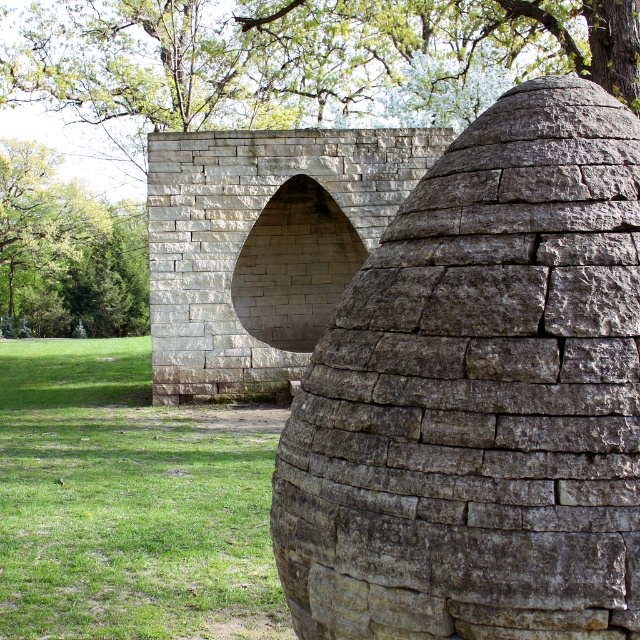
How distant is green grass at lower left from green leafy tree at upper left?

28.91 meters

Which is behind, point (116, 394) or point (33, 216)?

Point (33, 216)

Where is `green grass at lower left`? Image resolution: width=640 pixels, height=640 pixels. green grass at lower left is located at coordinates (129, 502).

Is gray stone dome at center to the right of green leafy tree at upper left from the viewer's perspective?

Correct, you'll find gray stone dome at center to the right of green leafy tree at upper left.

Is point (477, 257) positioned in front of point (38, 289)?

Yes.

The height and width of the screenshot is (640, 640). Find the location of `gray stone dome at center`. gray stone dome at center is located at coordinates (480, 396).

Does point (596, 113) lie behind point (22, 612)?

That is False.

How far apart are gray stone dome at center and green grass at lower left?

gray stone dome at center and green grass at lower left are 6.67 meters apart.

Describe the element at coordinates (480, 396) in the screenshot. I see `gray stone dome at center` at that location.

The width and height of the screenshot is (640, 640). In order to click on gray stone dome at center in this screenshot , I will do `click(480, 396)`.